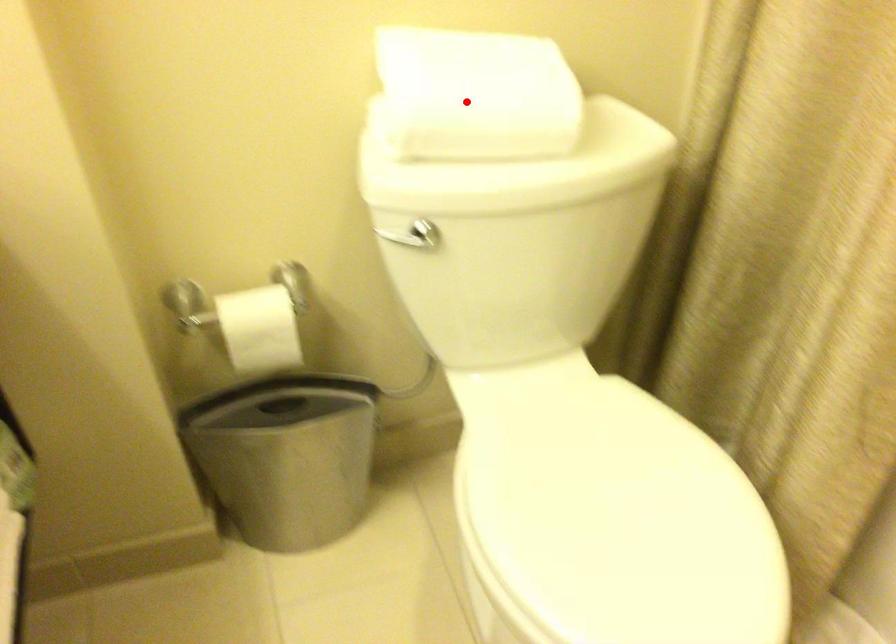
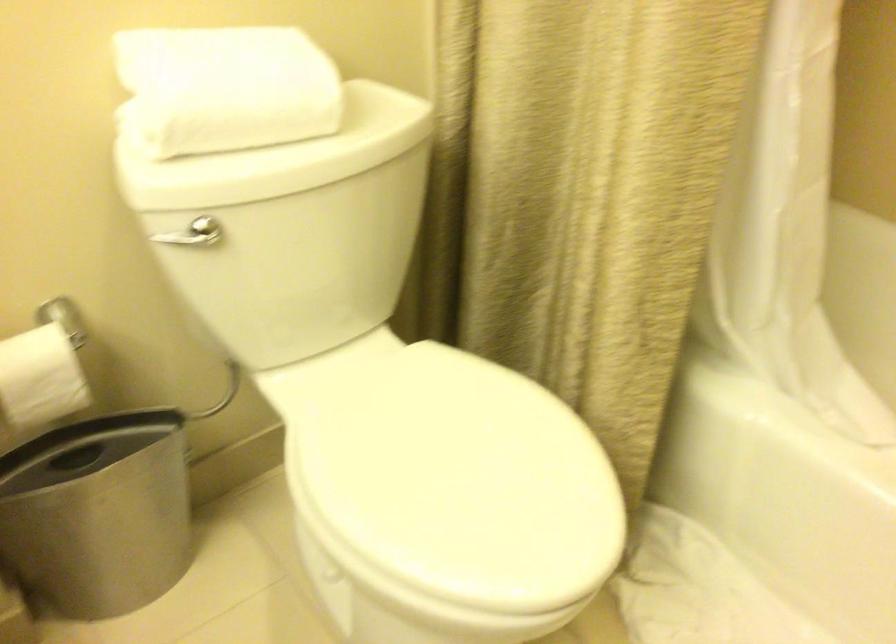
Locate, in the second image, the point that corresponds to the highlighted location in the first image.

(225, 88)